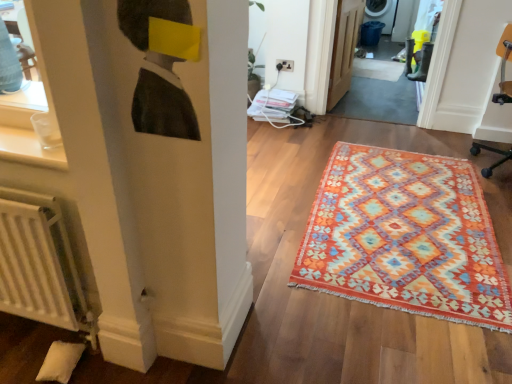
The image size is (512, 384). Find the location of `orange woven rug at center`. orange woven rug at center is located at coordinates (377, 69).

What is the approximate width of wooden door at center?

It is 5.52 inches.

Locate an element on the screen. The height and width of the screenshot is (384, 512). multicolored woven rug at center is located at coordinates (405, 237).

Can orange woven rug at center be found inside multicolored woven rug at center?

No, multicolored woven rug at center does not contain orange woven rug at center.

Between multicolored woven rug at center and orange woven rug at center, which one has more height?

Standing taller between the two is orange woven rug at center.

From a real-world perspective, is multicolored woven rug at center beneath orange woven rug at center?

Actually, multicolored woven rug at center is physically above orange woven rug at center in the real world.

How far apart are multicolored woven rug at center and orange woven rug at center?

multicolored woven rug at center is 2.74 meters away from orange woven rug at center.

Is orange fabric swivel chair at right spatially inside orange woven rug at center, or outside of it?

orange fabric swivel chair at right is spatially situated outside orange woven rug at center.

Is point (511, 32) farther from camera compared to point (354, 59)?

No.

Is orange woven rug at center at the back of orange fabric swivel chair at right?

No.

Is orange fabric swivel chair at right closer to the viewer compared to orange woven rug at center?

That is True.

How much distance is there between orange woven rug at center and white matte radiator at lower left?

The distance of orange woven rug at center from white matte radiator at lower left is 4.00 meters.

You are a GUI agent. You are given a task and a screenshot of the screen. Output one action in this format:
    pyautogui.click(x=<x>, y=<y>)
    Task: Click on the doormat on the right of white matte radiator at lower left
    The image size is (512, 384).
    Given the screenshot: What is the action you would take?
    pyautogui.click(x=377, y=69)

From a real-world perspective, is orange woven rug at center above or below white matte radiator at lower left?

In terms of real-world spatial position, orange woven rug at center is below white matte radiator at lower left.

Which of these two, orange woven rug at center or white matte radiator at lower left, is thinner?

Thinner between the two is white matte radiator at lower left.

Is orange woven rug at center aimed at wooden door at center?

No, orange woven rug at center is not oriented towards wooden door at center.

Is orange woven rug at center thinner than wooden door at center?

No.

You are a GUI agent. You are given a task and a screenshot of the screen. Output one action in this format:
    pyautogui.click(x=<x>, y=<y>)
    Task: Click on the door above the orange woven rug at center (from a real-world perspective)
    The height and width of the screenshot is (384, 512).
    Given the screenshot: What is the action you would take?
    pyautogui.click(x=344, y=48)

Based on their sizes in the image, would you say orange woven rug at center is bigger or smaller than wooden door at center?

Clearly, orange woven rug at center is smaller in size than wooden door at center.

Does orange fabric swivel chair at right appear on the right side of multicolored woven rug at center?

Yes.

Which of these two, orange fabric swivel chair at right or multicolored woven rug at center, is bigger?

Bigger between the two is orange fabric swivel chair at right.

From the picture: Is multicolored woven rug at center at the back of orange fabric swivel chair at right?

No, orange fabric swivel chair at right's orientation is not away from multicolored woven rug at center.

Is point (503, 40) positioned in front of point (368, 160)?

Yes, point (503, 40) is closer to viewer.

Image resolution: width=512 pixels, height=384 pixels. I want to click on door located above the orange fabric swivel chair at right (from a real-world perspective), so coord(344,48).

Is orange fabric swivel chair at right positioned with its back to wooden door at center?

orange fabric swivel chair at right is not turned away from wooden door at center.

Considering the sizes of objects orange fabric swivel chair at right and wooden door at center in the image provided, who is bigger, orange fabric swivel chair at right or wooden door at center?

orange fabric swivel chair at right.

From the picture: How far apart are orange woven rug at center and multicolored woven rug at center?

orange woven rug at center is 2.74 meters away from multicolored woven rug at center.

Which is in front, point (375, 74) or point (461, 263)?

The point (461, 263) is more forward.

Relative to multicolored woven rug at center, is orange woven rug at center in front or behind?

orange woven rug at center is behind multicolored woven rug at center.

Looking at this image, is orange woven rug at center aimed at multicolored woven rug at center?

Yes, orange woven rug at center faces towards multicolored woven rug at center.

The width and height of the screenshot is (512, 384). In order to click on mat in front of the orange woven rug at center in this screenshot , I will do `click(405, 237)`.

Find the location of `doormat that appears above the orange fabric swivel chair at right (from the image's perspective)`. doormat that appears above the orange fabric swivel chair at right (from the image's perspective) is located at coordinates (377, 69).

Which object lies further to the anchor point orange fabric swivel chair at right, white matte radiator at lower left or multicolored woven rug at center?

white matte radiator at lower left.

When comparing their distances from wooden door at center, does multicolored woven rug at center or white matte radiator at lower left seem closer?

multicolored woven rug at center is positioned closer to the anchor wooden door at center.

Considering their positions, is wooden door at center positioned further to orange fabric swivel chair at right than multicolored woven rug at center?

multicolored woven rug at center.

In the scene shown: When comparing their distances from white matte radiator at lower left, does multicolored woven rug at center or orange fabric swivel chair at right seem closer?

multicolored woven rug at center is closer to white matte radiator at lower left.

Based on their spatial positions, is wooden door at center or orange fabric swivel chair at right further from multicolored woven rug at center?

wooden door at center is positioned further to the anchor multicolored woven rug at center.

Considering their positions, is white matte radiator at lower left positioned closer to orange fabric swivel chair at right than wooden door at center?

Among the two, wooden door at center is located nearer to orange fabric swivel chair at right.

Which object lies further to the anchor point multicolored woven rug at center, white matte radiator at lower left or orange fabric swivel chair at right?

Based on the image, orange fabric swivel chair at right appears to be further to multicolored woven rug at center.

When comparing their distances from multicolored woven rug at center, does orange fabric swivel chair at right or white matte radiator at lower left seem closer?

white matte radiator at lower left lies closer to multicolored woven rug at center than the other object.

At what (x,y) coordinates should I click in order to perform the action: click on door positioned between multicolored woven rug at center and orange woven rug at center from near to far. Please return your answer as a coordinate pair (x, y). The width and height of the screenshot is (512, 384). Looking at the image, I should click on (344, 48).

At what (x,y) coordinates should I click in order to perform the action: click on door between white matte radiator at lower left and orange woven rug at center in the front-back direction. Please return your answer as a coordinate pair (x, y). The image size is (512, 384). Looking at the image, I should click on click(x=344, y=48).

This screenshot has height=384, width=512. In order to click on door between orange fabric swivel chair at right and orange woven rug at center from front to back in this screenshot , I will do `click(344, 48)`.

This screenshot has height=384, width=512. Identify the location of mat between white matte radiator at lower left and wooden door at center along the z-axis. (405, 237).